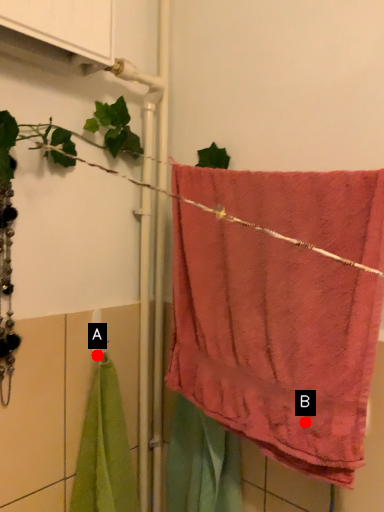
Question: Two points are circled on the image, labeled by A and B beside each circle. Which point is closer to the camera?

Choices:
 (A) A is closer
 (B) B is closer

Answer: (B)